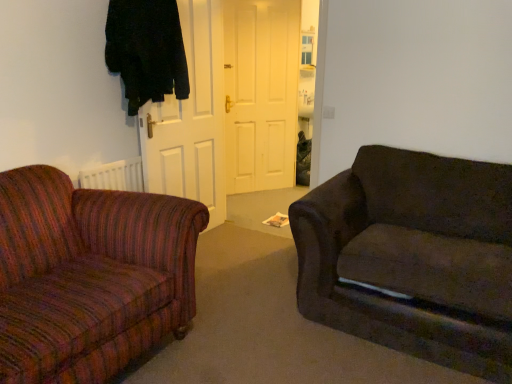
Question: Is white matte door at center, the 2th door positioned from the back, oriented towards white matte door at center, which is the first door in back-to-front order?

Choices:
 (A) no
 (B) yes

Answer: (A)

Question: From the image's perspective, would you say white matte door at center, marked as the second door in a right-to-left arrangement, is shown under white matte door at center, which is the first door in back-to-front order?

Choices:
 (A) yes
 (B) no

Answer: (A)

Question: Is white matte door at center, the first door viewed from the left, wider than white matte door at center, which is the 2th door from left to right?

Choices:
 (A) no
 (B) yes

Answer: (A)

Question: Does white matte door at center, marked as the second door in a right-to-left arrangement, have a larger size compared to white matte door at center, which is the 2th door from left to right?

Choices:
 (A) yes
 (B) no

Answer: (B)

Question: Is white matte door at center, marked as the second door in a right-to-left arrangement, to the left of white matte door at center, positioned as the 2th door in front-to-back order, from the viewer's perspective?

Choices:
 (A) no
 (B) yes

Answer: (B)

Question: Does point (185, 36) appear closer or farther from the camera than point (295, 81)?

Choices:
 (A) farther
 (B) closer

Answer: (B)

Question: From a real-world perspective, is white matte door at center, the first door viewed from the left, above or below white matte door at center, which is the first door in back-to-front order?

Choices:
 (A) below
 (B) above

Answer: (A)

Question: Is white matte door at center, which ranks as the first door in front-to-back order, in front of or behind white matte door at center, which is the 2th door from left to right, in the image?

Choices:
 (A) behind
 (B) front

Answer: (B)

Question: From the image's perspective, is white matte door at center, the 2th door positioned from the back, located above or below white matte door at center, which is the first door in back-to-front order?

Choices:
 (A) below
 (B) above

Answer: (A)

Question: From the image's perspective, relative to dark fabric couch at right, is black fabric coat at upper left above or below?

Choices:
 (A) above
 (B) below

Answer: (A)

Question: Is black fabric coat at upper left inside or outside of dark fabric couch at right?

Choices:
 (A) inside
 (B) outside

Answer: (B)

Question: Is black fabric coat at upper left taller or shorter than dark fabric couch at right?

Choices:
 (A) short
 (B) tall

Answer: (A)

Question: Is black fabric coat at upper left wider or thinner than dark fabric couch at right?

Choices:
 (A) thin
 (B) wide

Answer: (A)

Question: Does point (459, 327) appear closer or farther from the camera than point (178, 18)?

Choices:
 (A) closer
 (B) farther

Answer: (A)

Question: From the image's perspective, relative to black fabric coat at upper left, is dark fabric couch at right above or below?

Choices:
 (A) above
 (B) below

Answer: (B)